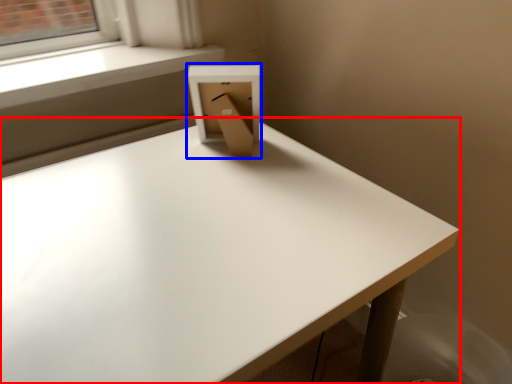
Question: Which point is further to the camera, table (highlighted by a red box) or cardboard box (highlighted by a blue box)?

Choices:
 (A) table
 (B) cardboard box

Answer: (B)